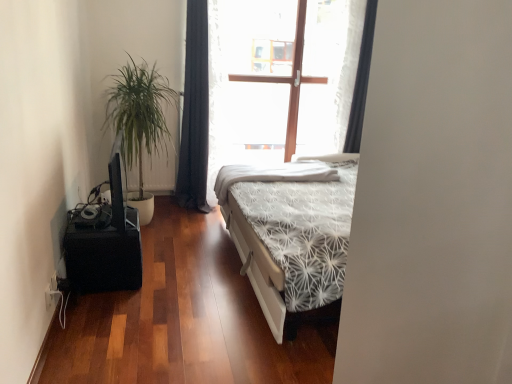
Question: Is black matte speaker at lower left taller or shorter than white textured bedsheet at center?

Choices:
 (A) tall
 (B) short

Answer: (A)

Question: From a real-world perspective, relative to white textured bedsheet at center, is black matte speaker at lower left vertically above or below?

Choices:
 (A) above
 (B) below

Answer: (B)

Question: Which object is the farthest from the black fabric curtain at center, the second curtain positioned from the right?

Choices:
 (A) black fabric curtain at upper right, the second curtain viewed from the left
 (B) green leafy plant at left
 (C) black matte speaker at lower left
 (D) white textured bedsheet at center

Answer: (C)

Question: Which object is positioned farthest from the black fabric curtain at center, the 1th curtain from the left?

Choices:
 (A) black matte speaker at lower left
 (B) black fabric curtain at upper right, the second curtain viewed from the left
 (C) green leafy plant at left
 (D) white textured bedsheet at center

Answer: (A)